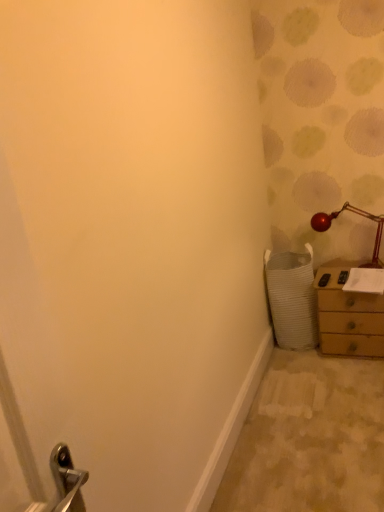
Question: Could wooden chest of drawers at right be considered to be inside metallic red lamp at upper right?

Choices:
 (A) no
 (B) yes

Answer: (A)

Question: Does metallic red lamp at upper right touch wooden chest of drawers at right?

Choices:
 (A) no
 (B) yes

Answer: (A)

Question: From a real-world perspective, does metallic red lamp at upper right stand above wooden chest of drawers at right?

Choices:
 (A) yes
 (B) no

Answer: (A)

Question: Is metallic red lamp at upper right thinner than wooden chest of drawers at right?

Choices:
 (A) yes
 (B) no

Answer: (A)

Question: Does metallic red lamp at upper right come in front of wooden chest of drawers at right?

Choices:
 (A) no
 (B) yes

Answer: (A)

Question: Does metallic red lamp at upper right appear on the right side of wooden chest of drawers at right?

Choices:
 (A) yes
 (B) no

Answer: (B)

Question: Is wooden chest of drawers at right not within metallic red lamp at upper right?

Choices:
 (A) no
 (B) yes

Answer: (B)

Question: Does wooden chest of drawers at right touch metallic red lamp at upper right?

Choices:
 (A) yes
 (B) no

Answer: (B)

Question: Is wooden chest of drawers at right not close to metallic red lamp at upper right?

Choices:
 (A) no
 (B) yes

Answer: (A)

Question: Is wooden chest of drawers at right bigger than metallic red lamp at upper right?

Choices:
 (A) yes
 (B) no

Answer: (A)

Question: Considering the relative sizes of wooden chest of drawers at right and metallic red lamp at upper right in the image provided, is wooden chest of drawers at right shorter than metallic red lamp at upper right?

Choices:
 (A) yes
 (B) no

Answer: (B)

Question: Is wooden chest of drawers at right wider than metallic red lamp at upper right?

Choices:
 (A) yes
 (B) no

Answer: (A)

Question: From a real-world perspective, is metallic red lamp at upper right above or below wooden chest of drawers at right?

Choices:
 (A) above
 (B) below

Answer: (A)